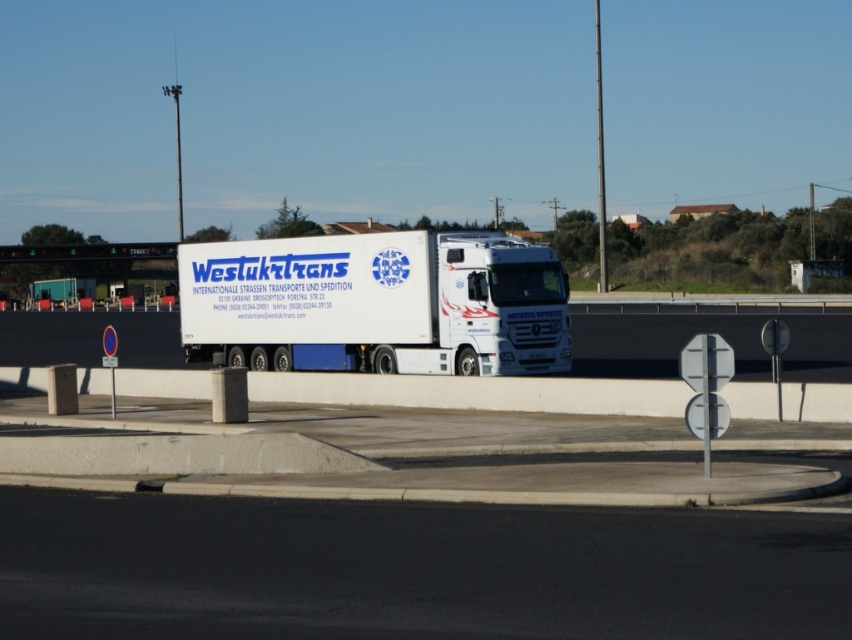
You are a driver who needs to know if your vehicle can pass through a narrow tunnel. The tunnel has a height restriction of 4 meters. Based on the image, can you determine if the white glossy truck at center is shorter than the green electronic sign at upper center?

The white glossy truck at center is smaller than the green electronic sign at upper center, but without knowing the exact height of the sign, we cannot confirm if the truck is under 4 meters. You should measure the truck or check official specifications.

You are a delivery driver who needs to enter a tunnel that has a height restriction of 4 meters. You see the white glossy trailer truck at center and the green electronic sign at upper center in your view. Which object is taller and could potentially exceed the height limit?

The green electronic sign at upper center is taller than the white glossy trailer truck at center. Since the sign is taller, it might exceed the 4 meter height limit more than the truck.

You are standing at the edge of the road where the no parking sign is located and want to cross the road to the white glossy trailer truck at center. The road has two lanes. The first lane is 10 feet wide, and the second lane is 12 feet wide. Can you safely cross the road to reach the truck within 15 seconds if you walk at a speed of 3 feet per second?

The total distance to cross the road is 10 feet plus 12 feet equals 22 feet. At a walking speed of 3 feet per second, it would take approximately 7.3 seconds to cross. Since the white glossy trailer truck at center is 123.04 feet away from the viewer, you can safely cross the road within 15 seconds and reach the truck.